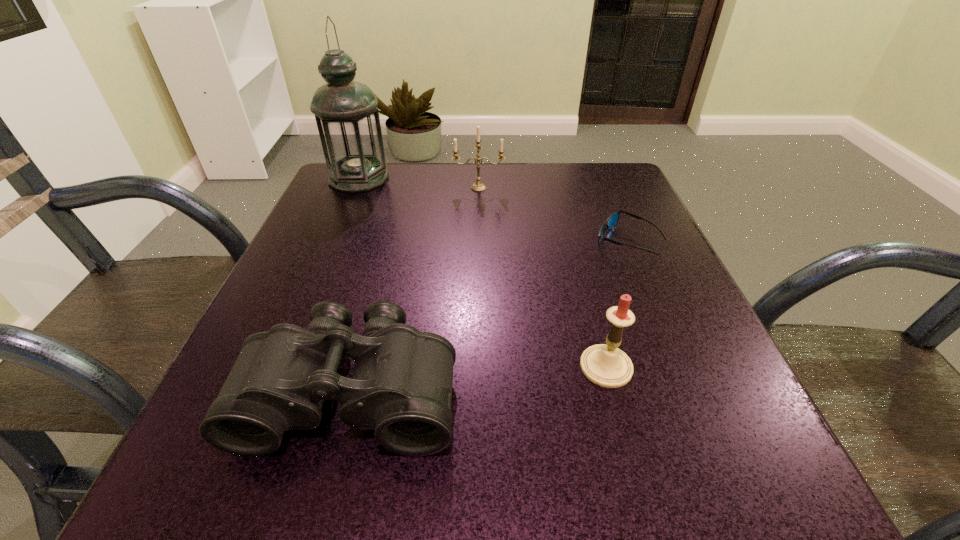
Identify the location of the tallest object. (346, 113).

Image resolution: width=960 pixels, height=540 pixels. In order to click on the farther candle in this screenshot , I will do `click(478, 186)`.

At what (x,y) coordinates should I click in order to perform the action: click on the right candle. Please return your answer as a coordinate pair (x, y). The width and height of the screenshot is (960, 540). Looking at the image, I should click on (607, 366).

Find the location of `the nearer candle`. the nearer candle is located at coordinates (607, 366).

This screenshot has width=960, height=540. In order to click on the second shortest object in this screenshot , I will do `click(401, 386)`.

Locate an element on the screen. The height and width of the screenshot is (540, 960). the rightmost object is located at coordinates (611, 222).

Find the location of a particular element. This screenshot has width=960, height=540. the third farthest object is located at coordinates (611, 222).

Identify the location of vacant space located 0.130m on the right of the tallest object. (441, 178).

Image resolution: width=960 pixels, height=540 pixels. I want to click on blank area located 0.070m on the right of the left candle, so pos(534,188).

Where is `blank space located 0.140m on the left of the fourth object from left to right`? The image size is (960, 540). blank space located 0.140m on the left of the fourth object from left to right is located at coordinates pos(487,367).